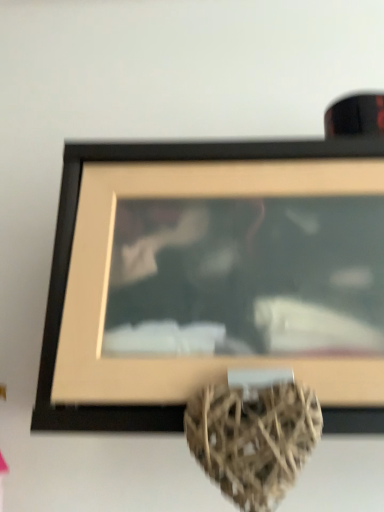
What do you see at coordinates (214, 279) in the screenshot?
I see `black matte picture frame at upper center` at bounding box center [214, 279].

The height and width of the screenshot is (512, 384). In order to click on black matte picture frame at upper center in this screenshot , I will do `click(214, 279)`.

Locate an element on the screen. The image size is (384, 512). black matte picture frame at upper center is located at coordinates (214, 279).